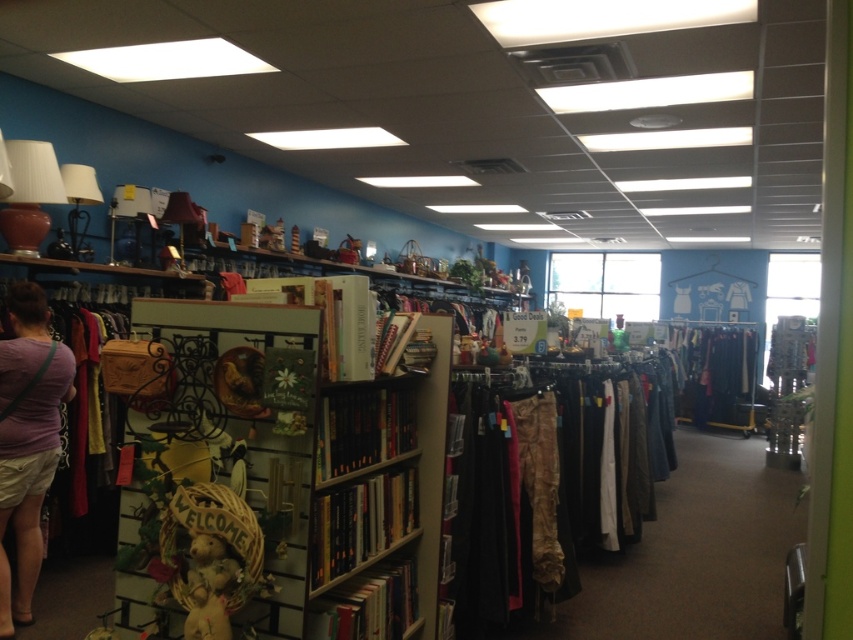
Question: Among these objects, which one is nearest to the camera?

Choices:
 (A) purple cotton shirt at left
 (B) wooden bookshelf at center
 (C) camouflage pants at center

Answer: (B)

Question: Does wooden bookshelf at center have a larger size compared to purple cotton shirt at left?

Choices:
 (A) yes
 (B) no

Answer: (A)

Question: Does wooden bookshelf at center appear on the right side of purple cotton shirt at left?

Choices:
 (A) yes
 (B) no

Answer: (A)

Question: Is wooden bookshelf at center to the right of purple cotton shirt at left from the viewer's perspective?

Choices:
 (A) no
 (B) yes

Answer: (B)

Question: Estimate the real-world distances between objects in this image. Which object is closer to the purple cotton t-shirt at left?

Choices:
 (A) purple cotton shirt at left
 (B) camouflage pants at center
 (C) wooden bookshelf at center

Answer: (A)

Question: Which point appears closest to the camera in this image?

Choices:
 (A) (10, 452)
 (B) (569, 484)
 (C) (67, 387)

Answer: (A)